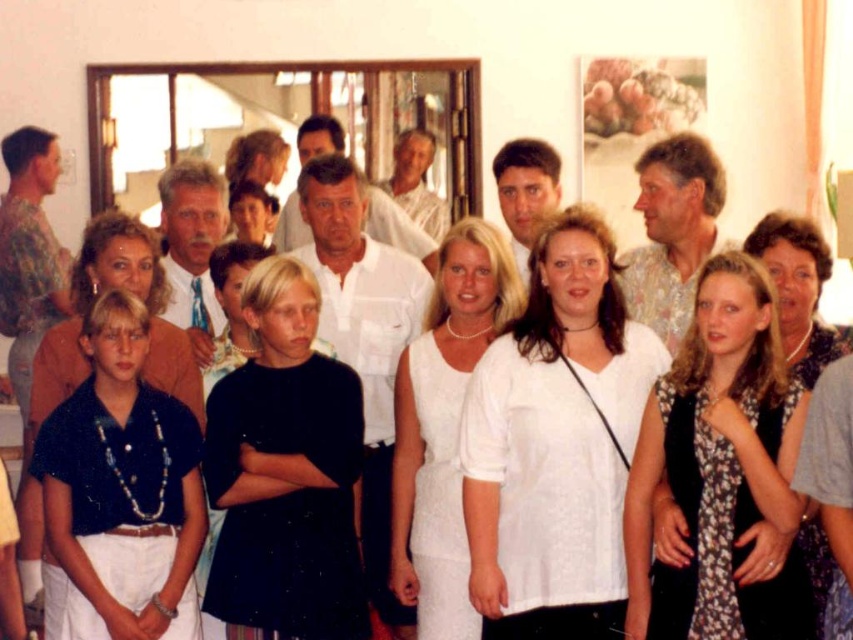
Is point (633, 508) more distant than point (108, 81)?

That is False.

Locate an element on the screen. This screenshot has width=853, height=640. floral dress at center is located at coordinates (720, 470).

Does matte glass mirror at center have a lesser height compared to dark blue shirt at center?

Incorrect, matte glass mirror at center's height does not fall short of dark blue shirt at center's.

Is point (405, 61) behind point (44, 614)?

Yes, it is behind point (44, 614).

Who is more distant from viewer, (320, 65) or (141, 248)?

Point (320, 65)

Find the location of a particular element. The width and height of the screenshot is (853, 640). matte glass mirror at center is located at coordinates (291, 128).

Is white lace blouse at center above black matte dress at center?

Yes.

Describe the element at coordinates (555, 444) in the screenshot. Image resolution: width=853 pixels, height=640 pixels. I see `white lace blouse at center` at that location.

Locate an element on the screen. white lace blouse at center is located at coordinates (555, 444).